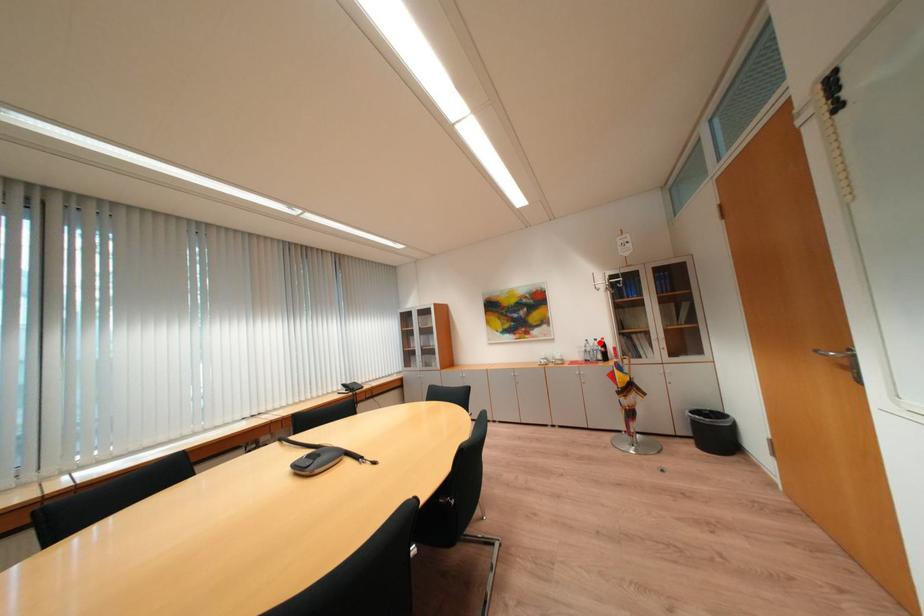
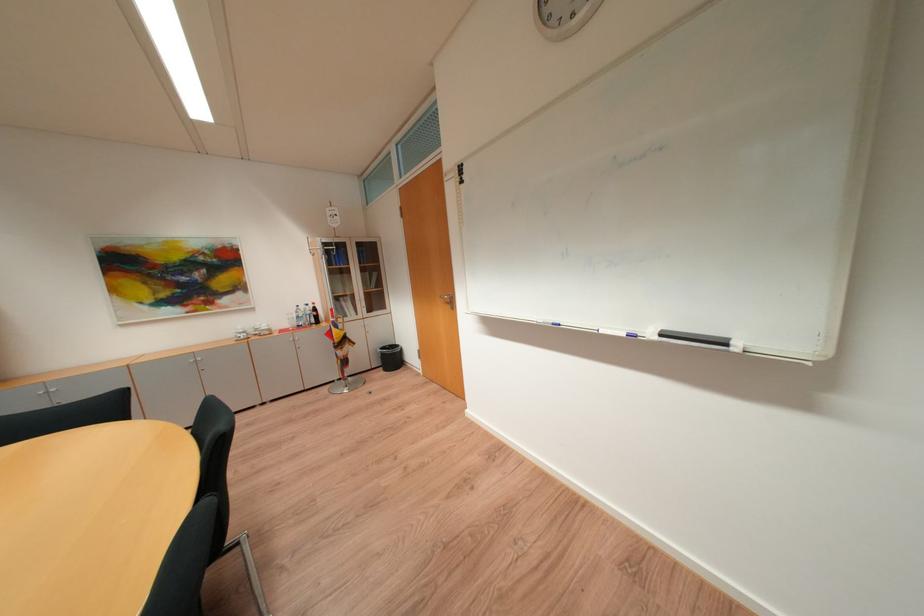
Find the pixel in the second image that matches the highlighted location in the first image.

(310, 309)